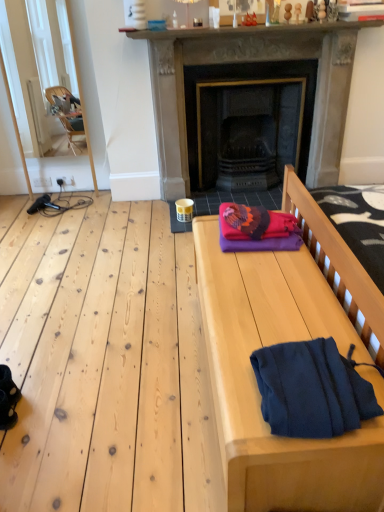
You are a GUI agent. You are given a task and a screenshot of the screen. Output one action in this format:
    pyautogui.click(x=<x>, y=<y>)
    Task: Click on the vacant area on the back side of dark blue fleece at lower right
    
    Given the screenshot: What is the action you would take?
    pyautogui.click(x=284, y=319)